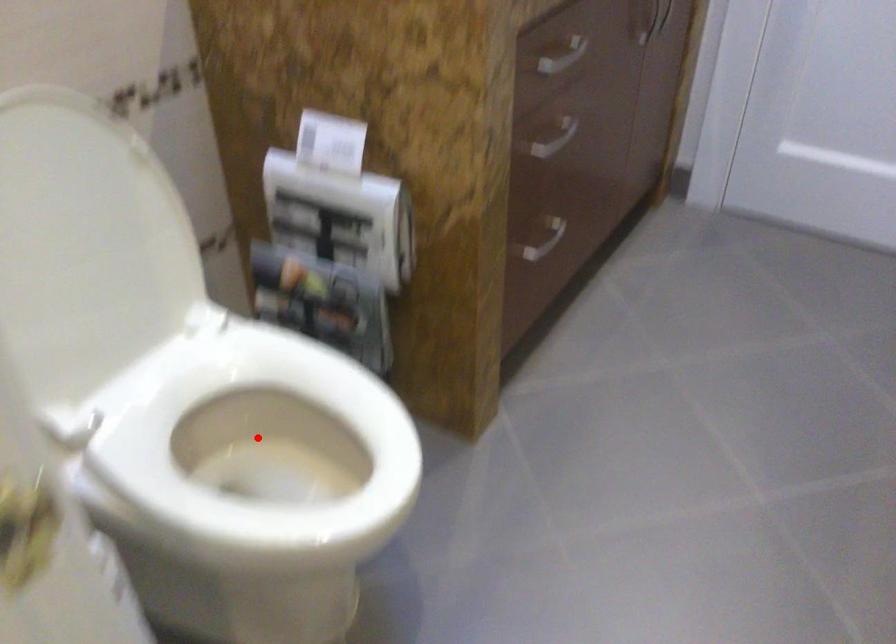
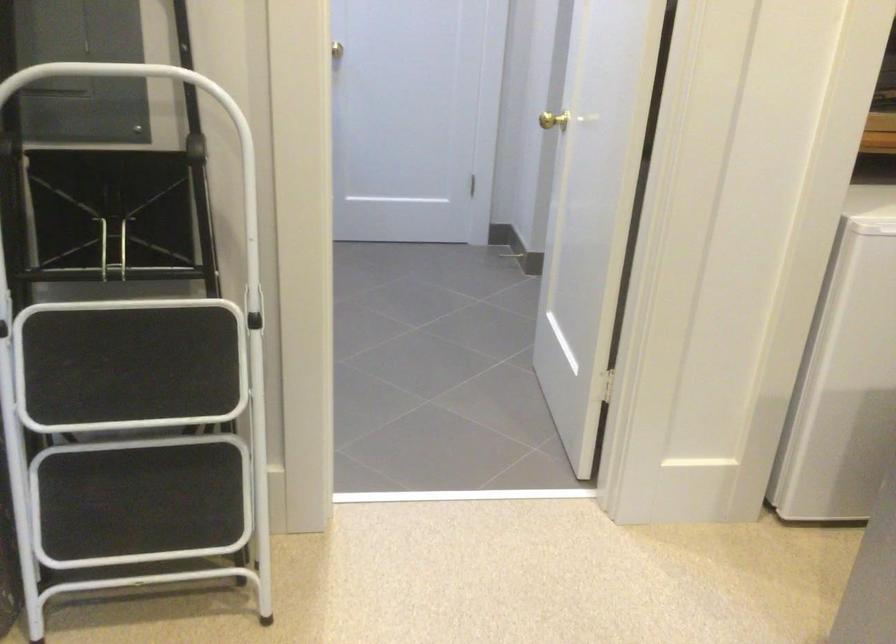
Question: I am providing you with two images of the same scene from different viewpoints. A red point is marked on the first image. Is the red point's position out of view in image 2?

Choices:
 (A) Yes
 (B) No

Answer: (A)